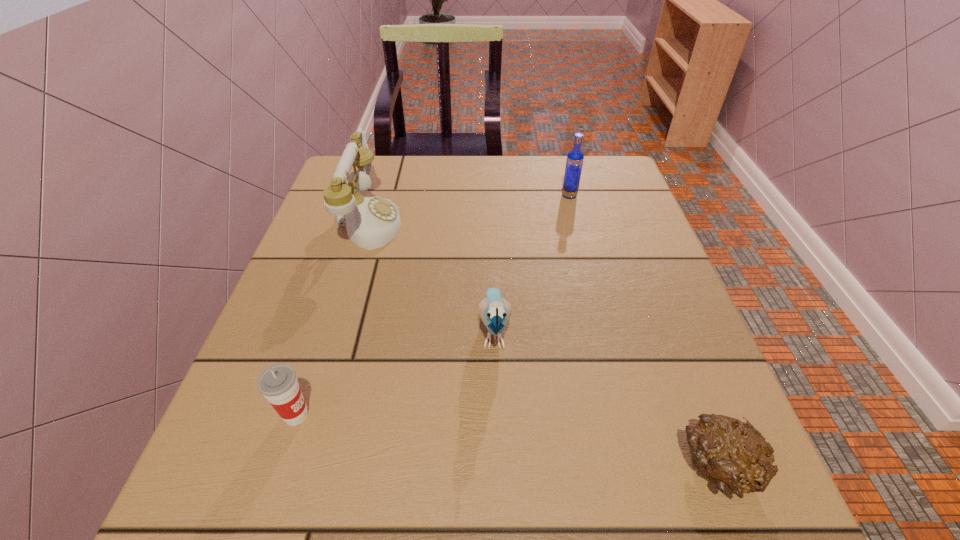
This screenshot has height=540, width=960. Find the location of `telephone`. telephone is located at coordinates (371, 222).

You are a GUI agent. You are given a task and a screenshot of the screen. Output one action in this format:
    pyautogui.click(x=<x>, y=<y>)
    Task: Click on the vodka
    The width and height of the screenshot is (960, 540).
    Given the screenshot: What is the action you would take?
    pyautogui.click(x=574, y=162)

Locate an element on the screen. the third farthest object is located at coordinates (494, 311).

You are a GUI agent. You are given a task and a screenshot of the screen. Output one action in this format:
    pyautogui.click(x=<x>, y=<y>)
    Task: Click on the bird
    Image resolution: width=960 pixels, height=540 pixels.
    Given the screenshot: What is the action you would take?
    pyautogui.click(x=494, y=311)

This screenshot has width=960, height=540. Identify the location of the second nearest object. (278, 383).

Identify the location of the shortest object. This screenshot has height=540, width=960. (733, 455).

Where is `muffin`? muffin is located at coordinates (733, 455).

Locate an element on the screen. This screenshot has height=540, width=960. vacant area situated on the dial of the telephone is located at coordinates (467, 222).

Locate an element on the screen. vacant position located on the left of the vodka is located at coordinates (506, 195).

This screenshot has width=960, height=540. Identify the location of vacant space located 0.140m at the face of the bird. (497, 461).